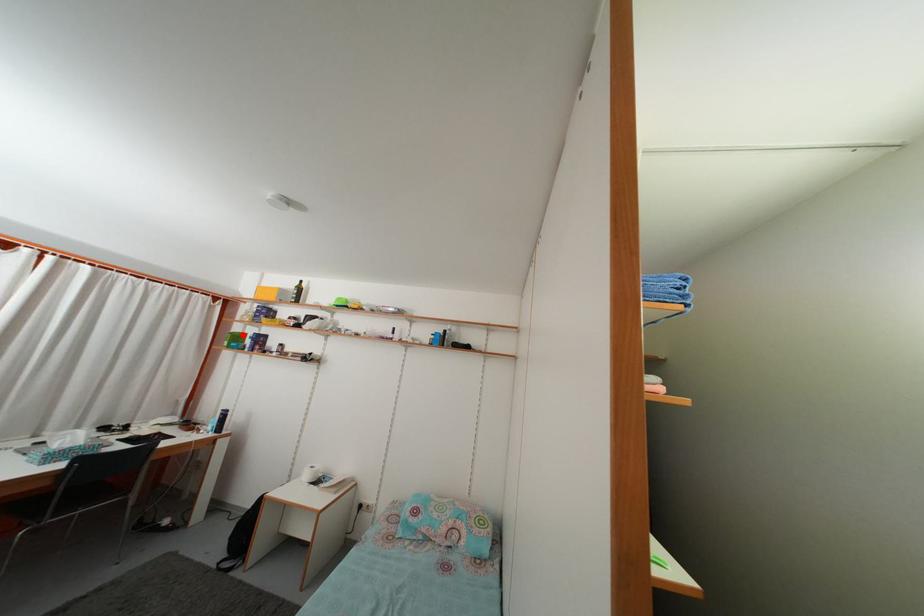
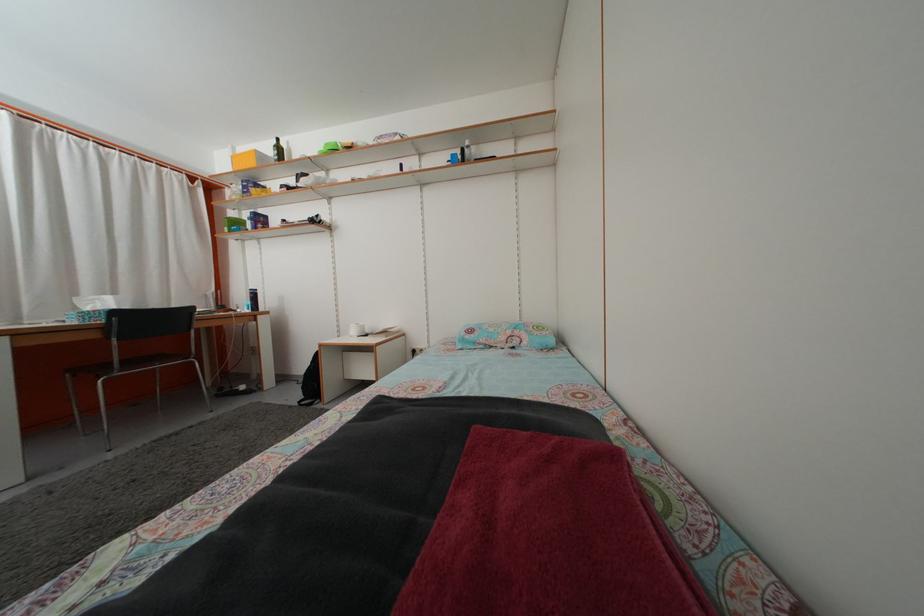
In the second image, find the point that corresponds to the highlighted location in the first image.

(237, 223)